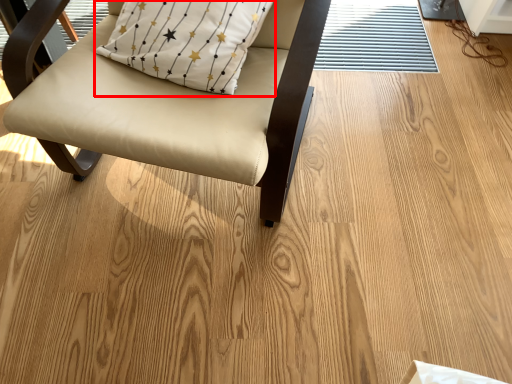
Question: In this image, where is pillow (annotated by the red box) located relative to chair?

Choices:
 (A) left
 (B) right

Answer: (B)